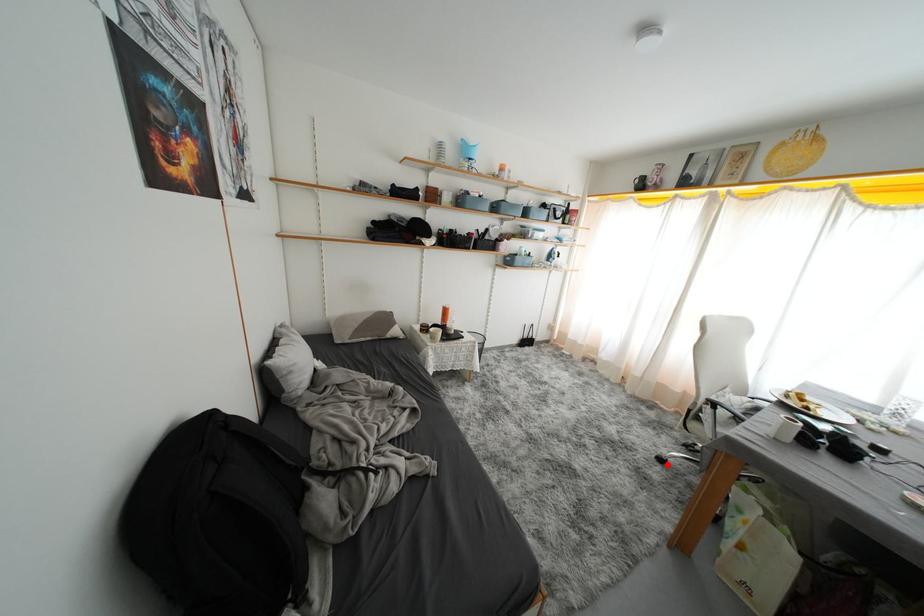
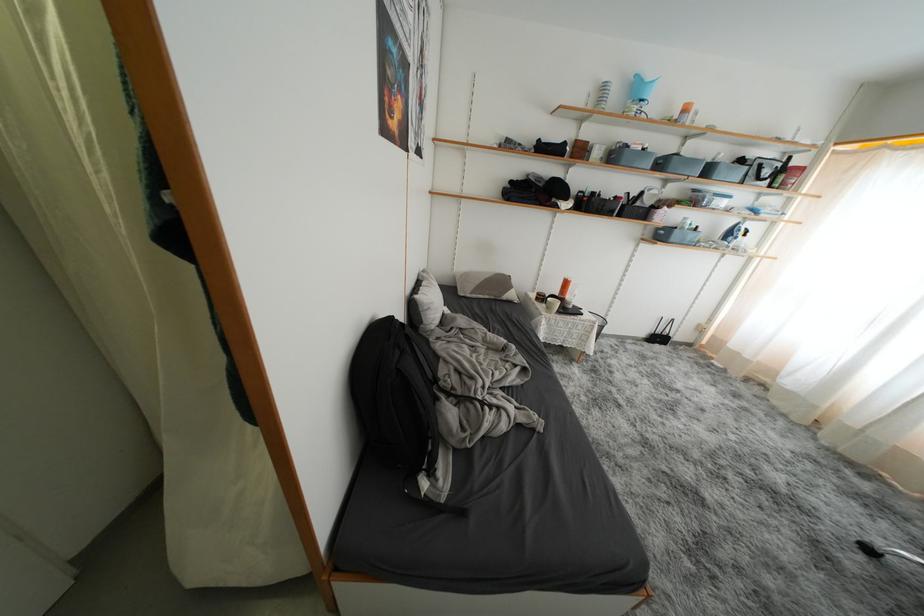
In the second image, find the point that corresponds to the highlighted location in the first image.

(876, 554)